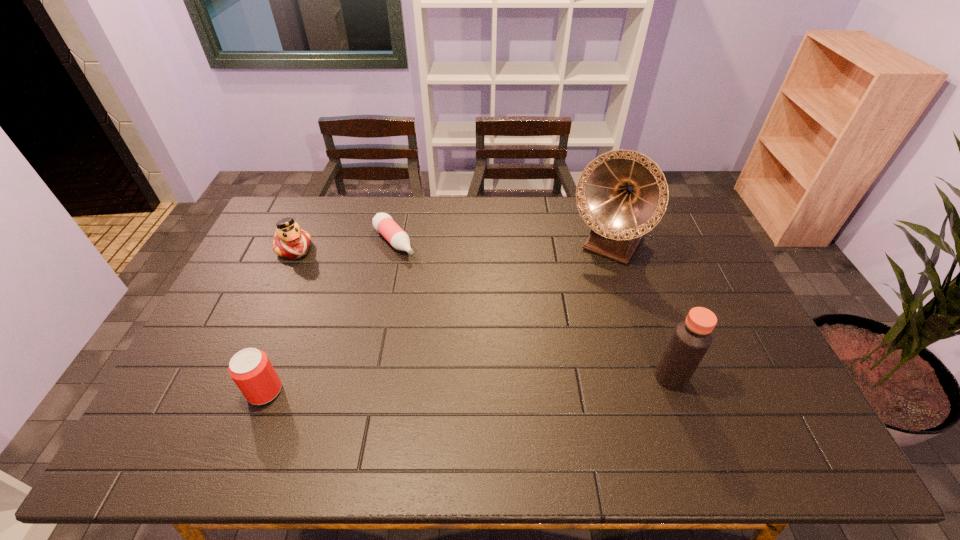
Locate an element on the screen. vacant space located 0.230m on the horn of the phonograph record is located at coordinates (564, 314).

This screenshot has height=540, width=960. In order to click on vacant space located on the face of the duck in this screenshot , I will do `click(356, 313)`.

Identify the location of vacant point located on the face of the duck. (313, 269).

Image resolution: width=960 pixels, height=540 pixels. What are the coordinates of `vacant space located 0.260m on the face of the duck` in the screenshot? It's located at (344, 300).

Identify the location of vacant space located with the cap open on the shortest object. This screenshot has width=960, height=540. (441, 295).

You are a GUI agent. You are given a task and a screenshot of the screen. Output one action in this format:
    pyautogui.click(x=<x>, y=<y>)
    Task: Click on the vacant area situated with the cap open on the shortest object
    The width and height of the screenshot is (960, 540).
    Given the screenshot: What is the action you would take?
    pyautogui.click(x=444, y=299)

The image size is (960, 540). In order to click on vacant region located with the cap open on the shortest object in this screenshot , I will do `click(462, 318)`.

The width and height of the screenshot is (960, 540). What are the coordinates of `phonograph record present at the far edge` in the screenshot? It's located at (621, 195).

I want to click on duck located in the far edge section of the desktop, so click(x=290, y=241).

Locate an element on the screen. bottle present at the far edge is located at coordinates (383, 223).